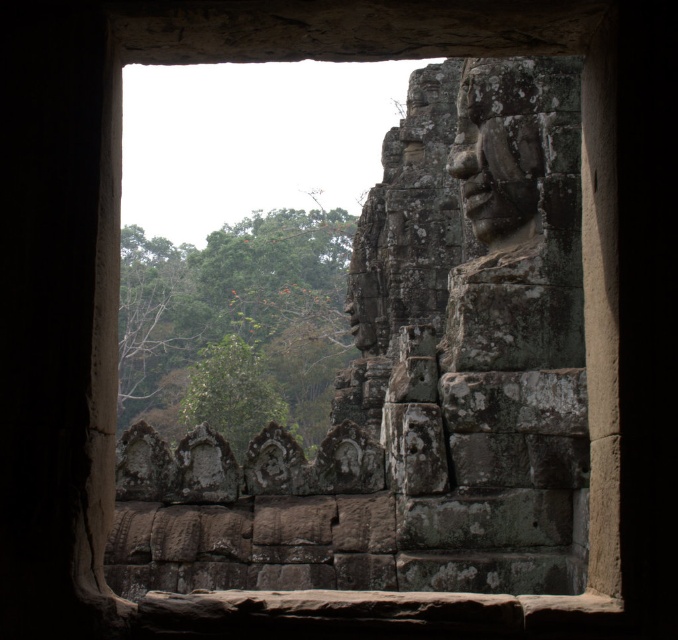
Question: Which point is closer to the camera?

Choices:
 (A) rough stone face at upper right
 (B) green leafy tree at left

Answer: (A)

Question: Can you confirm if green leafy tree at left is wider than rough stone face at upper right?

Choices:
 (A) no
 (B) yes

Answer: (B)

Question: Is the position of green leafy tree at left less distant than that of rough stone face at upper right?

Choices:
 (A) no
 (B) yes

Answer: (A)

Question: Considering the relative positions of green leafy tree at left and rough stone face at upper right in the image provided, where is green leafy tree at left located with respect to rough stone face at upper right?

Choices:
 (A) left
 (B) right

Answer: (A)

Question: Which point is farther from the camera taking this photo?

Choices:
 (A) (296, 369)
 (B) (498, 154)

Answer: (A)

Question: Which of the following is the closest to the observer?

Choices:
 (A) green leafy tree at left
 (B) rough stone face at upper right

Answer: (B)